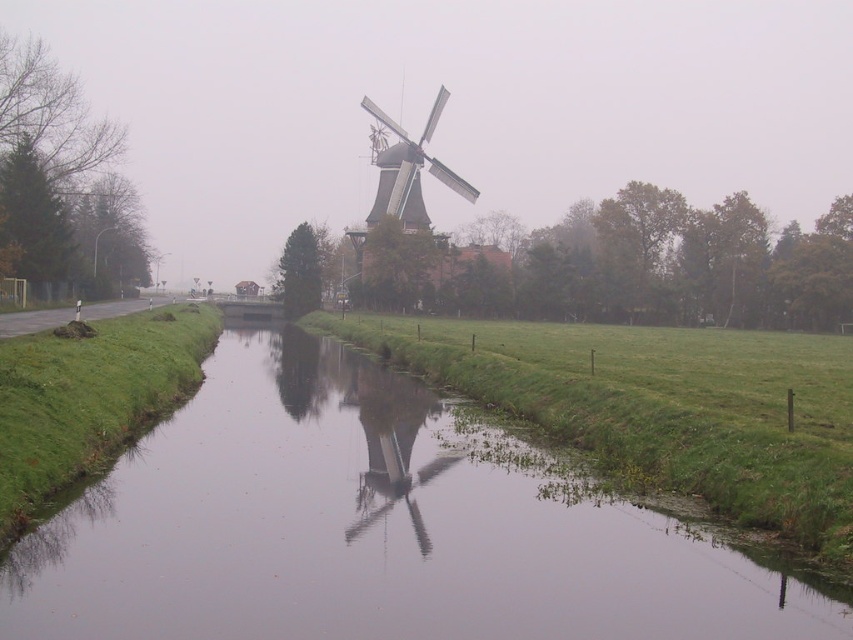
Question: Is green grassy stream at center below greenish-brown wooden windmill at center?

Choices:
 (A) no
 (B) yes

Answer: (B)

Question: Does green grassy stream at center come behind greenish-brown wooden windmill at center?

Choices:
 (A) no
 (B) yes

Answer: (A)

Question: Which of the following is the farthest from the observer?

Choices:
 (A) (422, 524)
 (B) (468, 196)

Answer: (B)

Question: Can you confirm if green grassy stream at center is positioned to the left of greenish-brown wooden windmill at center?

Choices:
 (A) yes
 (B) no

Answer: (B)